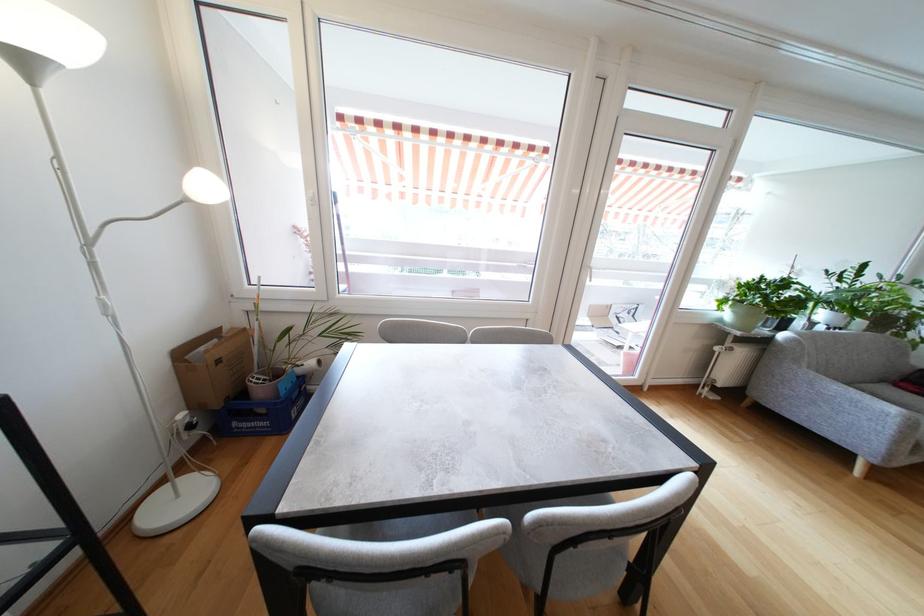
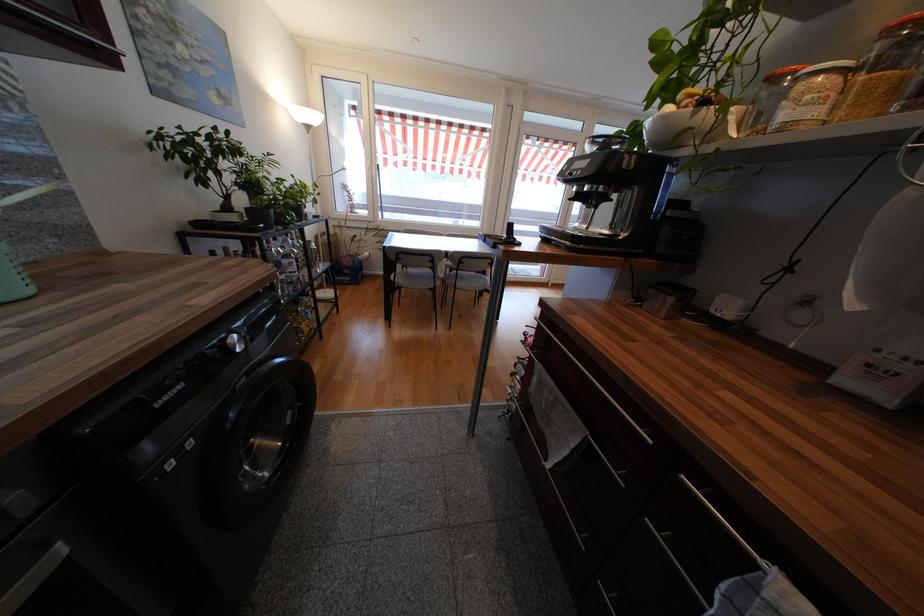
Question: In a continuous first-person perspective shot, in which direction is the camera moving?

Choices:
 (A) Left
 (B) Right
 (C) Forward
 (D) Backward

Answer: (D)